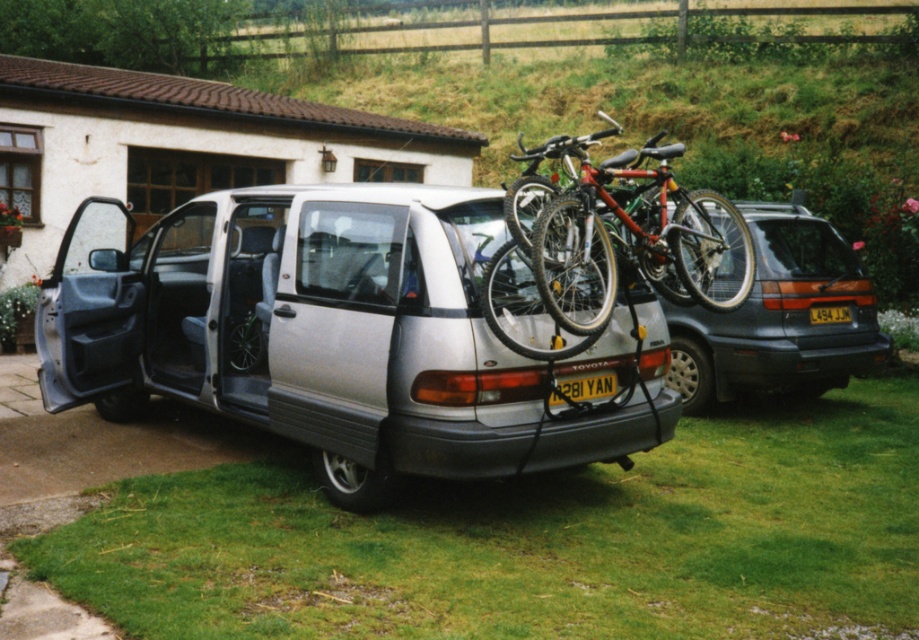
Who is lower down, matte silver minivan at center or yellow plastic license plate at rear?

yellow plastic license plate at rear is below.

Who is more distant from viewer, (x=840, y=372) or (x=837, y=320)?

The point (x=840, y=372) is more distant.

Describe the element at coordinates (779, 317) in the screenshot. I see `matte silver minivan at center` at that location.

Where is `matte silver minivan at center`? matte silver minivan at center is located at coordinates (779, 317).

Is point (384, 356) behind point (829, 307)?

No, it is in front of (829, 307).

Measure the distance from silver metallic van at center to yellow plastic license plate at rear.

They are 4.04 meters apart.

Is point (463, 356) in front of point (830, 312)?

Yes, it is.

You are a GUI agent. You are given a task and a screenshot of the screen. Output one action in this format:
    pyautogui.click(x=<x>, y=<y>)
    Task: Click on the silver metallic van at center
    This screenshot has height=640, width=919.
    Given the screenshot: What is the action you would take?
    pyautogui.click(x=336, y=333)

Is silver metallic van at center thinner than shiny metallic bicycle at rear?

In fact, silver metallic van at center might be wider than shiny metallic bicycle at rear.

Who is higher up, silver metallic van at center or shiny metallic bicycle at rear?

shiny metallic bicycle at rear is above.

The height and width of the screenshot is (640, 919). Find the location of `silver metallic van at center`. silver metallic van at center is located at coordinates (336, 333).